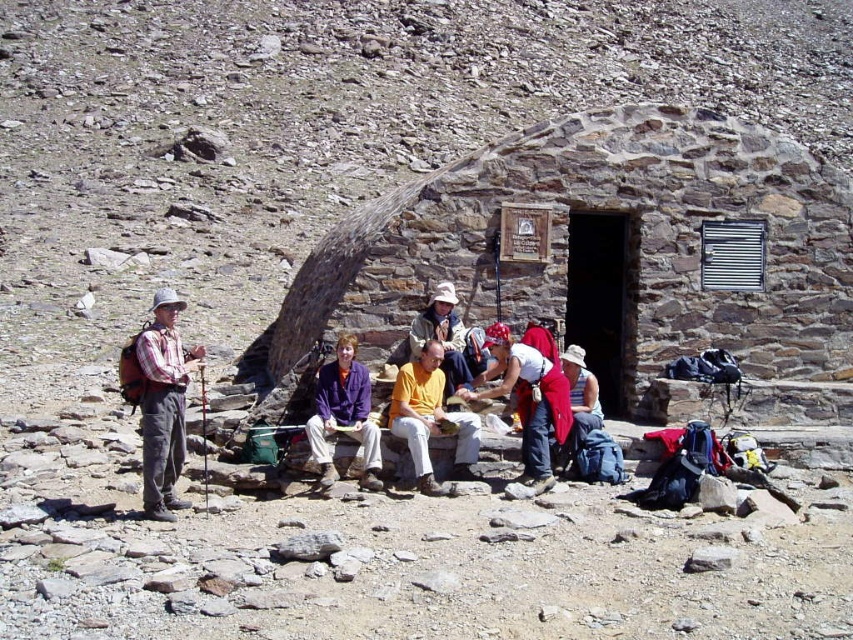
Question: Which of these objects is positioned closest to the red fabric shirt at center?

Choices:
 (A) matte yellow shirt at center
 (B) yellow matte shirt at center

Answer: (B)

Question: Which of the following is the farthest from the observer?

Choices:
 (A) yellow matte shirt at center
 (B) purple fleece jacket at center
 (C) matte yellow shirt at center
 (D) red fabric shirt at center

Answer: (C)

Question: Can you confirm if yellow matte shirt at center is positioned to the right of matte yellow shirt at center?

Choices:
 (A) yes
 (B) no

Answer: (B)

Question: Which point is farther from the camera taking this photo?

Choices:
 (A) (195, 348)
 (B) (540, 429)
 (C) (376, 444)
 (D) (457, 465)

Answer: (A)

Question: Can you confirm if stone textured hut at center is wider than matte yellow shirt at center?

Choices:
 (A) yes
 (B) no

Answer: (A)

Question: Can you confirm if red fabric shirt at center is positioned to the left of yellow matte shirt at center?

Choices:
 (A) no
 (B) yes

Answer: (A)